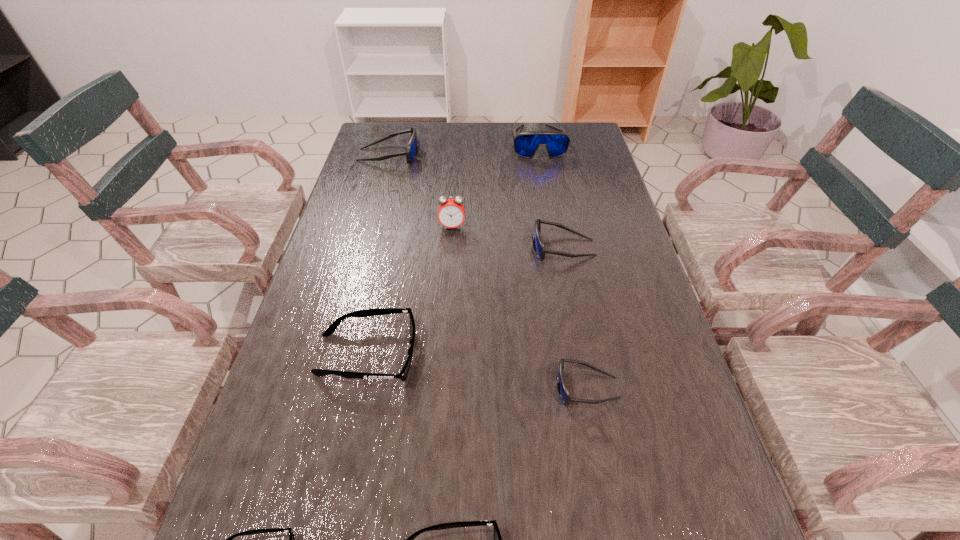
Where is `the tallest sunglasses`? the tallest sunglasses is located at coordinates (x=526, y=144).

Find the location of `red alarm clock`. red alarm clock is located at coordinates (451, 212).

I want to click on the second tallest sunglasses, so click(x=411, y=152).

The height and width of the screenshot is (540, 960). I want to click on the third tallest object, so pos(411,152).

Find the location of a particular element. The height and width of the screenshot is (540, 960). the fifth nearest sunglasses is located at coordinates (538, 245).

The width and height of the screenshot is (960, 540). In order to click on the fifth shortest object in this screenshot , I will do (538, 245).

Find the location of a particular element. This screenshot has height=540, width=960. the biggest black sunglasses is located at coordinates (330, 330).

Where is `the smallest blue sunglasses`? the smallest blue sunglasses is located at coordinates 561,385.

What are the coordinates of `vacant space located 0.390m on the front-facing side of the biggest blue sunglasses` in the screenshot? It's located at (555, 238).

Where is `vacant space located on the front-facing side of the alarm clock`? The width and height of the screenshot is (960, 540). vacant space located on the front-facing side of the alarm clock is located at coordinates (448, 279).